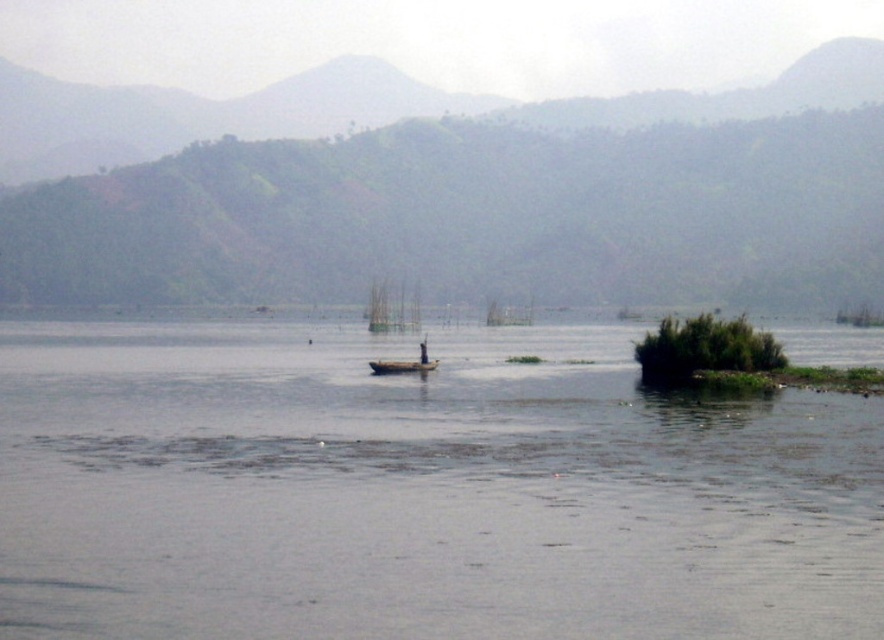
Who is more distant from viewer, [217,477] or [402,212]?

Positioned behind is point [402,212].

Is clear water at center taller than green grassy hill at center?

Incorrect, clear water at center's height is not larger of green grassy hill at center's.

Is point (309, 449) in front of point (44, 288)?

Yes.

This screenshot has height=640, width=884. What are the coordinates of `clear water at center` in the screenshot? It's located at (418, 492).

Does clear water at center appear on the right side of wooden canoe at center?

Correct, you'll find clear water at center to the right of wooden canoe at center.

Who is shorter, clear water at center or wooden canoe at center?

With less height is wooden canoe at center.

Between point (798, 628) and point (390, 372), which one is positioned in front?

Point (798, 628) is in front.

Locate an element on the screen. clear water at center is located at coordinates (418, 492).

Between green grassy hill at center and wooden canoe at center, which one is positioned lower?

wooden canoe at center is lower down.

Locate an element on the screen. The image size is (884, 640). green grassy hill at center is located at coordinates (490, 204).